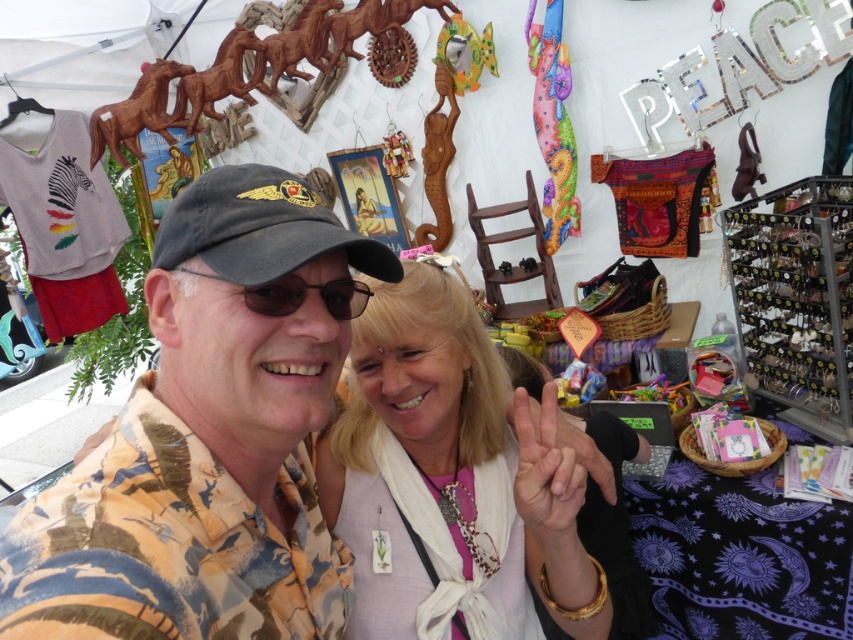
You are at a craft fair and want to locate the printed cotton shirt at center. According to the coordinates provided, where should you look?

The printed cotton shirt at center is located at point (x=210, y=436).

You are standing in front of the craft fair stall and want to determine which of the two points, point (601, 636) or point (204, 250), is closer to you. Based on the spatial arrangement, which point is nearer?

Point (601, 636) is further to the viewer than point (204, 250), so the closer point to you is point (204, 250).

You are setting up a display stand and need to arrange the printed cotton shirt at center and the black plastic goggles at center. If you want to place them side by side without overlapping, which object should you place on the left to ensure there is enough space?

The printed cotton shirt at center is wider than the black plastic goggles at center, so placing the printed cotton shirt at center on the left will ensure there is enough space between them without overlapping.